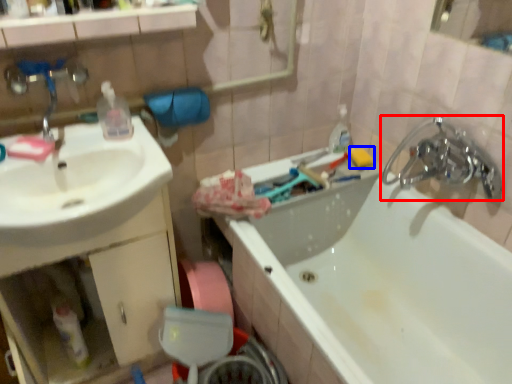
Question: Which of the following is the farthest to the observer, tap (highlighted by a red box) or soap (highlighted by a blue box)?

Choices:
 (A) tap
 (B) soap

Answer: (B)